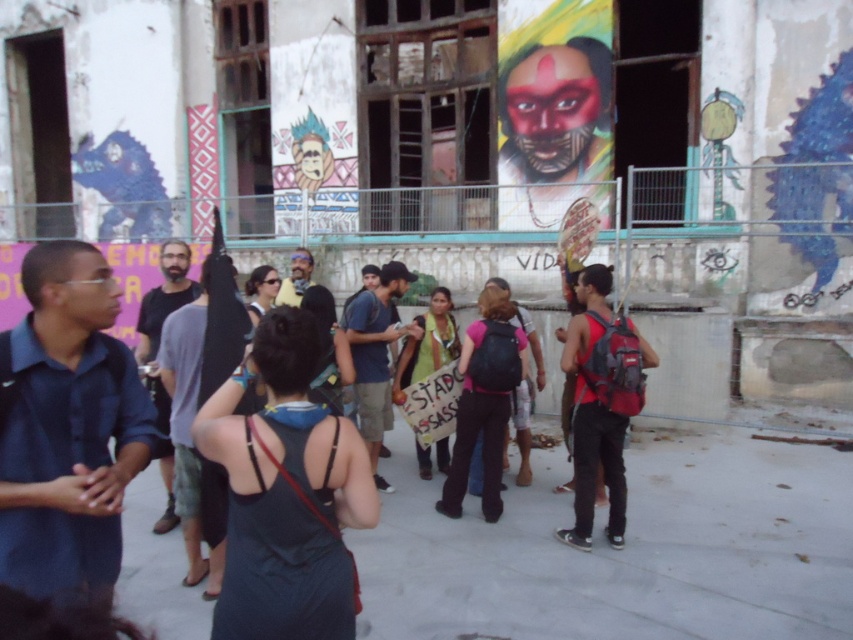
You are a photographer trying to capture both the matte red face paint at upper center and the pink fabric backpack at center in a single shot. Which object should you focus on first to ensure both are in frame?

The matte red face paint at upper center is much taller than the pink fabric backpack at center, so focusing on the matte red face paint at upper center first will help ensure both are in frame.

You are standing at the point labeled point (97,390). You want to move to the entrance of the building, which is 3 meters away from your current position. Can you reach the entrance without moving further than 3 meters?

The distance between point (97,390) and the viewer is 2.78 meters. Since the entrance is 3 meters away from your current position, you can reach it without exceeding the 3 meter limit.